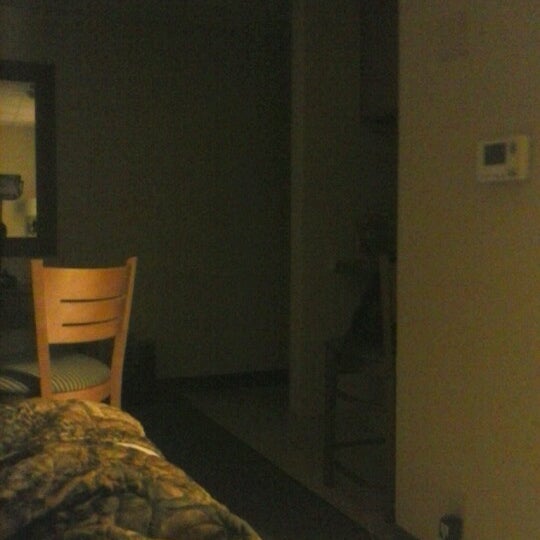
Locate an element on the screen. The height and width of the screenshot is (540, 540). bed or sofa is located at coordinates (134, 499), (77, 499), (77, 430).